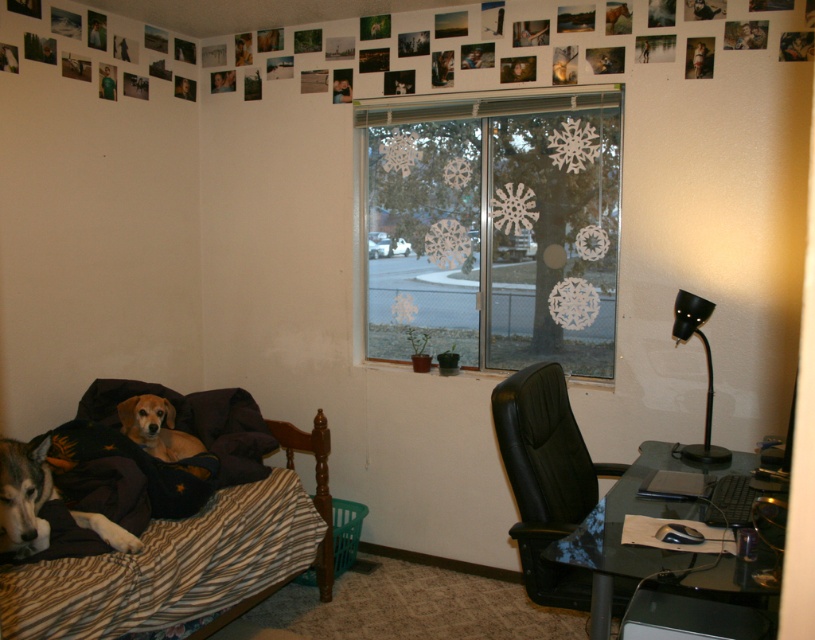
Does striped fabric bed at lower left lie in front of transparent glass computer desk at lower right?

No, striped fabric bed at lower left is behind transparent glass computer desk at lower right.

Between striped fabric bed at lower left and transparent glass computer desk at lower right, which one is positioned higher?

Result: striped fabric bed at lower left is above.

Is point (200, 528) in front of point (686, 518)?

No, (200, 528) is behind (686, 518).

The height and width of the screenshot is (640, 815). What are the coordinates of `striped fabric bed at lower left` in the screenshot? It's located at (166, 528).

Can you confirm if black leather chair at center is thinner than transparent glass computer desk at lower right?

Yes, black leather chair at center is thinner than transparent glass computer desk at lower right.

Is point (496, 433) farther from camera compared to point (641, 464)?

That is False.

What are the coordinates of `black leather chair at center` in the screenshot? It's located at (545, 477).

Does point (514, 163) come in front of point (560, 432)?

No, (514, 163) is behind (560, 432).

Is white paper snowflakes at center closer to the viewer compared to black leather chair at center?

That is False.

This screenshot has height=640, width=815. Describe the element at coordinates (496, 225) in the screenshot. I see `white paper snowflakes at center` at that location.

The height and width of the screenshot is (640, 815). I want to click on white paper snowflakes at center, so click(x=496, y=225).